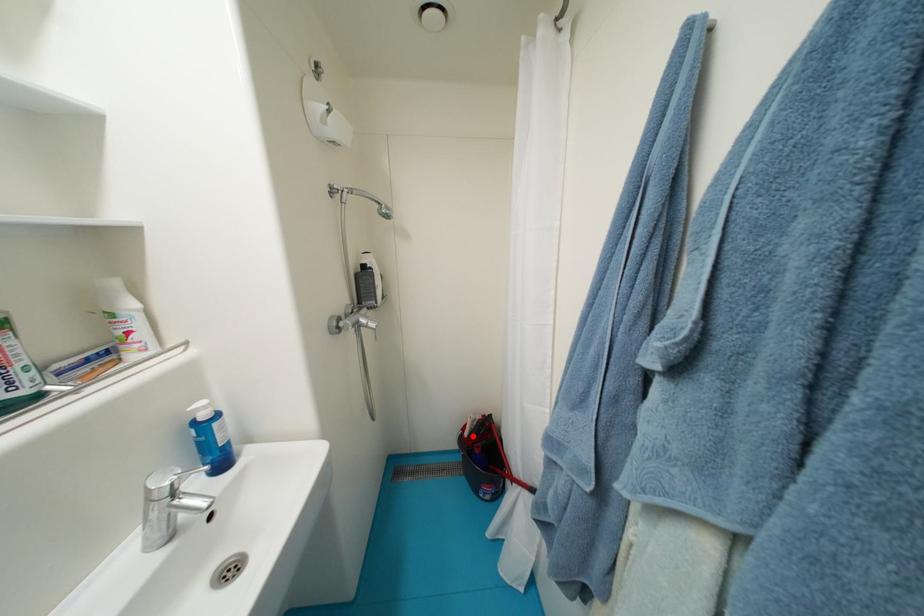
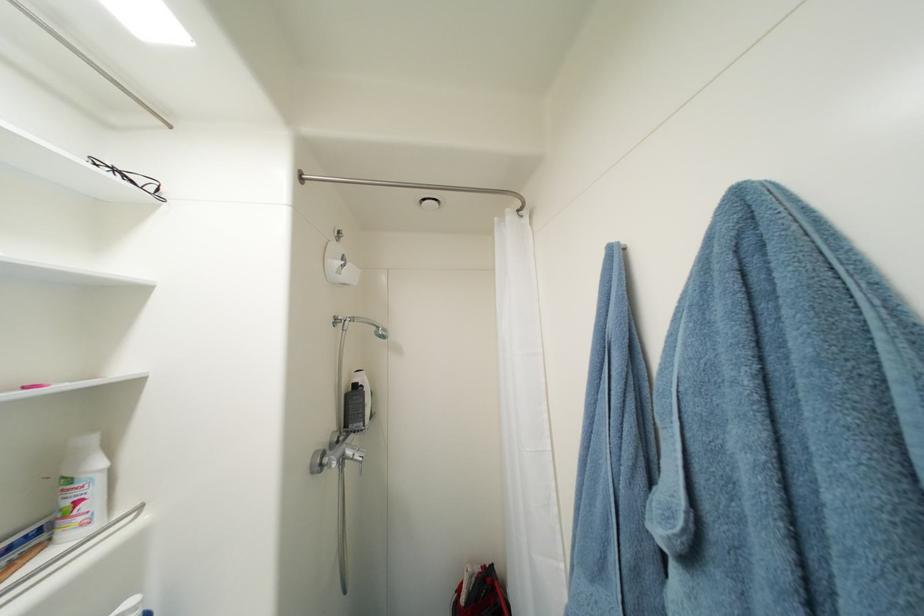
Where in the second image is the point corresponding to the highlighted location from the first image?

(469, 602)